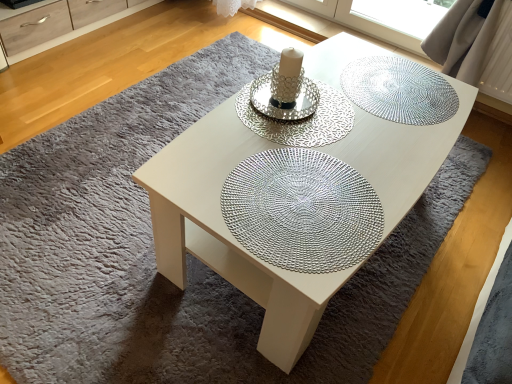
The height and width of the screenshot is (384, 512). I want to click on vacant space underneath metallic silver doily at upper right, which ranks as the first glass plate in back-to-front order (from a real-world perspective), so click(396, 89).